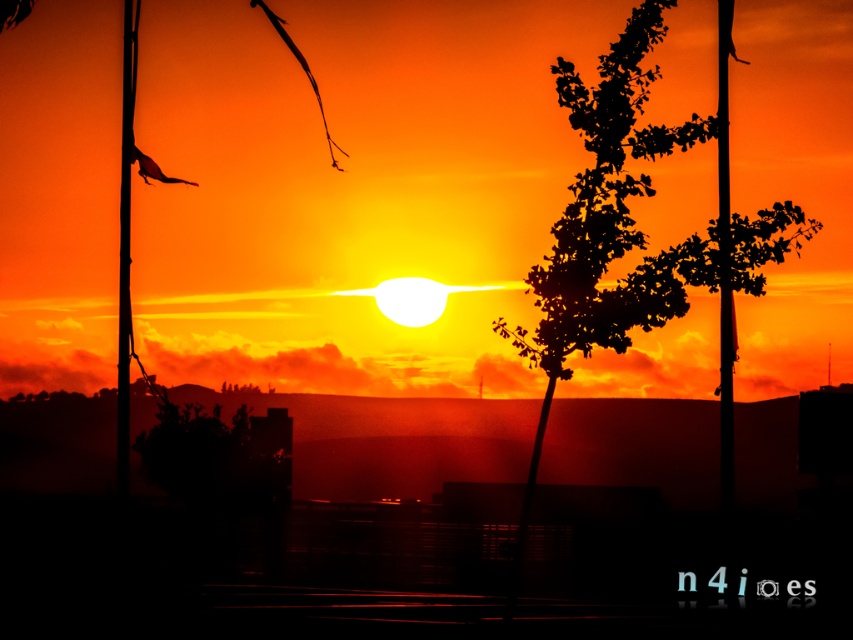
You are an artist setting up your easel to paint the sunset scene. You notice two poles in the foreground. Which pole, the black matte pole at center or the smooth metal pole at left, should you paint shorter to accurately depict their actual sizes?

The black matte pole at center is shorter than the smooth metal pole at left, so you should paint the black matte pole at center shorter than the smooth metal pole at left.

You are an artist setting up your easel to paint the sunset scene. You want to accurately depict the positions of the silhouette leafy tree at center and the black matte pole at center. Based on the scene, which object is positioned to the left?

The silhouette leafy tree at center is positioned to the left of the black matte pole at center.

You are standing at the origin point of the coordinate system in the image. You want to place a new decorative light exactly 0.1 units to the right of the black matte pole at center. What are the coordinates of the point where you should place the light?

The black matte pole at center is located at point (724, 262). Adding 0.1 to the x coordinate gives 0.512, so the coordinates are (724, 326).